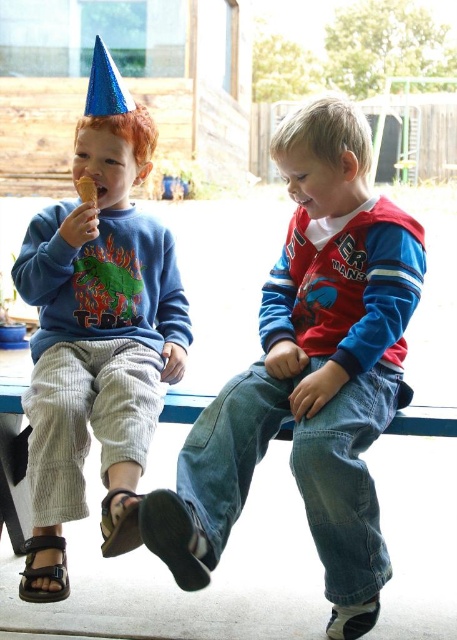
You are a photographer setting up a shot of the two children on the blue bench. You want to ensure the denim jeans at center and the black leather sandal at lower left are both visible in the frame. Based on their positions, which object should be placed higher in your composition?

The denim jeans at center should be placed higher in the composition because it is above the black leather sandal at lower left.

Consider the image. You are a photographer trying to capture a candid shot of the children without them noticing. You notice the denim jeans at center and the brown leather sandal at lower left. Which object is covering the other?

The denim jeans at center is positioned over the brown leather sandal at lower left, so the denim jeans are covering the sandal.